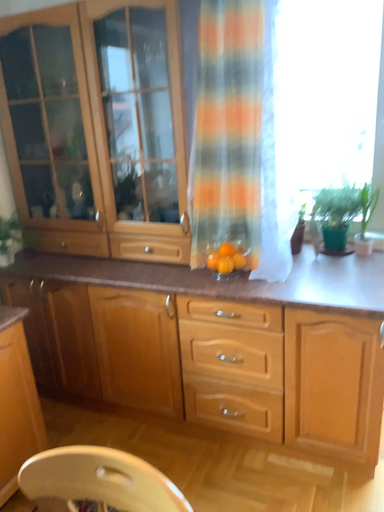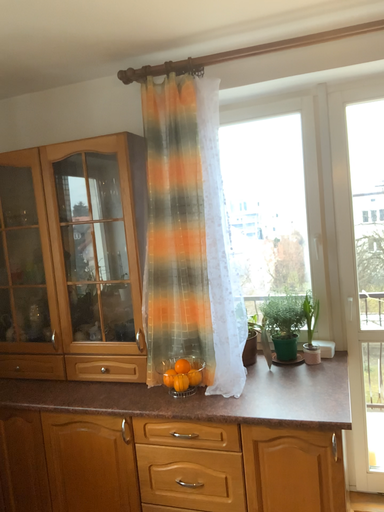
Question: How did the camera likely rotate when shooting the video?

Choices:
 (A) rotated upward
 (B) rotated downward

Answer: (A)